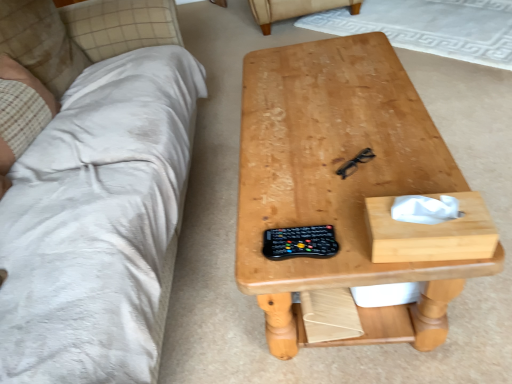
Question: Considering the relative sizes of natural wood table at center and beige plaid fabric at left in the image provided, is natural wood table at center wider than beige plaid fabric at left?

Choices:
 (A) no
 (B) yes

Answer: (B)

Question: Is natural wood table at center far from beige plaid fabric at left?

Choices:
 (A) yes
 (B) no

Answer: (B)

Question: From a real-world perspective, is natural wood table at center on beige plaid fabric at left?

Choices:
 (A) no
 (B) yes

Answer: (A)

Question: Does natural wood table at center have a greater height compared to beige plaid fabric at left?

Choices:
 (A) no
 (B) yes

Answer: (B)

Question: Is natural wood table at center to the right of beige plaid fabric at left from the viewer's perspective?

Choices:
 (A) yes
 (B) no

Answer: (A)

Question: From their relative heights in the image, would you say beige plaid fabric at left is taller or shorter than white soft pillow at upper left?

Choices:
 (A) short
 (B) tall

Answer: (A)

Question: From the image's perspective, is beige plaid fabric at left above or below white soft pillow at upper left?

Choices:
 (A) above
 (B) below

Answer: (B)

Question: Is beige plaid fabric at left bigger or smaller than white soft pillow at upper left?

Choices:
 (A) small
 (B) big

Answer: (B)

Question: Is beige plaid fabric at left wider or thinner than white soft pillow at upper left?

Choices:
 (A) wide
 (B) thin

Answer: (A)

Question: From the image's perspective, is beige plaid fabric at left located above or below natural wood table at center?

Choices:
 (A) above
 (B) below

Answer: (A)

Question: Which is correct: beige plaid fabric at left is inside natural wood table at center, or outside of it?

Choices:
 (A) outside
 (B) inside

Answer: (A)

Question: In the image, is beige plaid fabric at left positioned in front of or behind natural wood table at center?

Choices:
 (A) behind
 (B) front

Answer: (A)

Question: Is beige plaid fabric at left taller or shorter than natural wood table at center?

Choices:
 (A) tall
 (B) short

Answer: (B)

Question: Do you think black plastic remote at center is within beige fabric armchair at upper center, or outside of it?

Choices:
 (A) outside
 (B) inside

Answer: (A)

Question: Based on their positions, is black plastic remote at center located to the left or right of beige fabric armchair at upper center?

Choices:
 (A) right
 (B) left

Answer: (B)